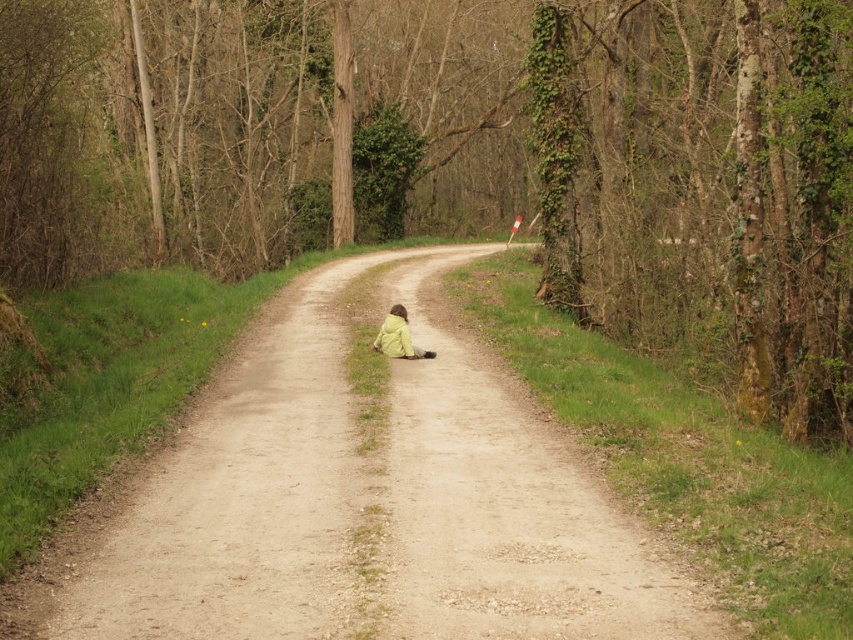
You are a hiker standing on the dirt road at center and see the yellow matte jacket at center. Which object is closer to the ground?

The dirt road at center is positioned under the yellow matte jacket at center, so the dirt road at center is closer to the ground.

You are a hiker who has just spotted a yellow matte jacket at center and a dirt road at center. According to the scene, which object is located to the left of the other?

The dirt road at center is positioned on the left side of yellow matte jacket at center, so the dirt road at center is to the left of the yellow matte jacket at center.

You are standing on the edge of the dirt road at center and want to walk to a tree located 20 feet away from you. Can you reach the tree within 2 steps if each step covers 3 feet?

The dirt road at center is 18.60 feet away from the viewer. Since the tree is 20 feet away from you, each step covers 3 feet, so two steps would cover 6 feet. Therefore, you cannot reach the tree within 2 steps as 6 feet is less than the required 20 feet distance.